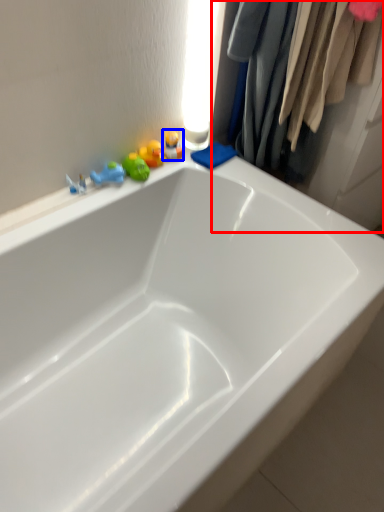
Question: Among these objects, which one is nearest to the camera, closet (highlighted by a red box) or toy (highlighted by a blue box)?

Choices:
 (A) closet
 (B) toy

Answer: (A)